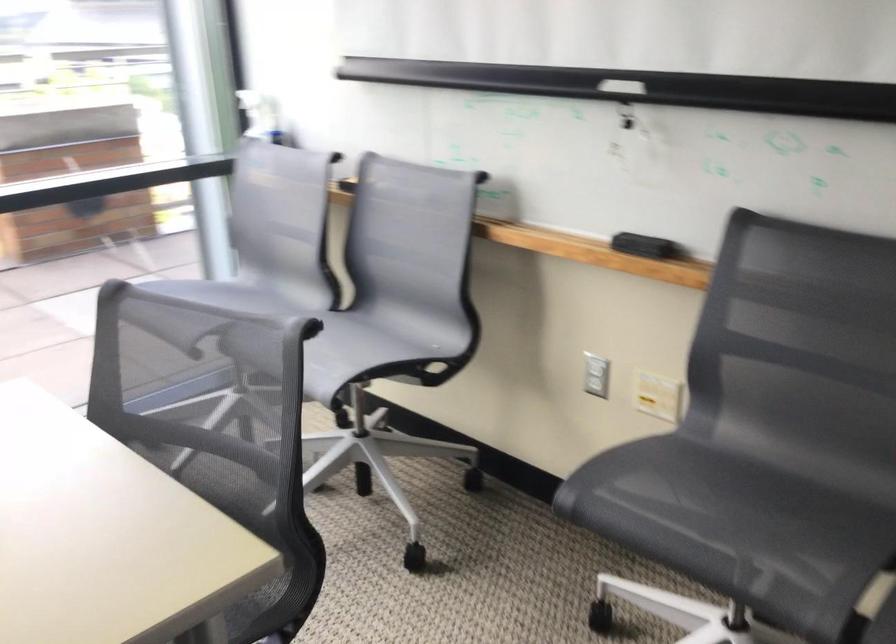
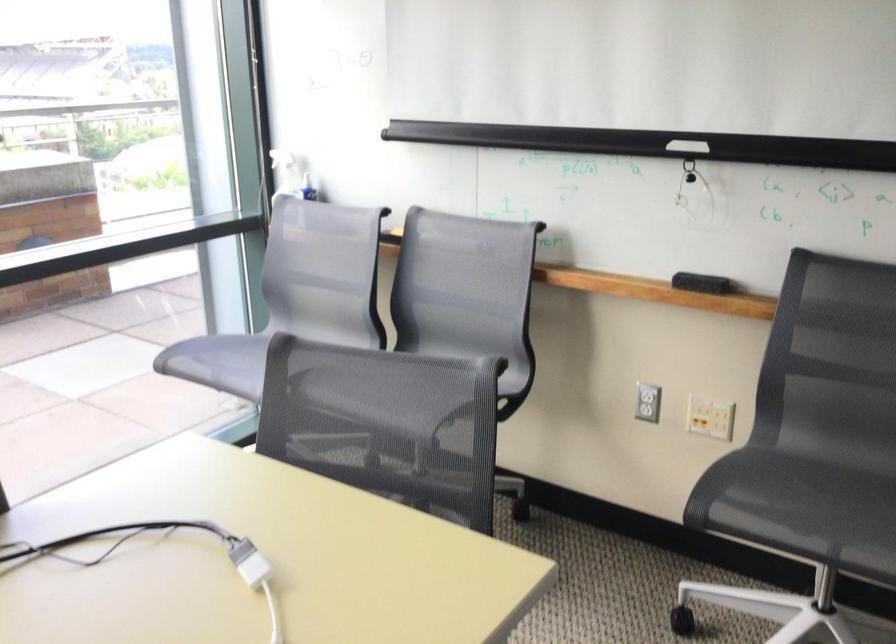
The point at [375,292] is marked in the first image. Where is the corresponding point in the second image?

(426, 337)